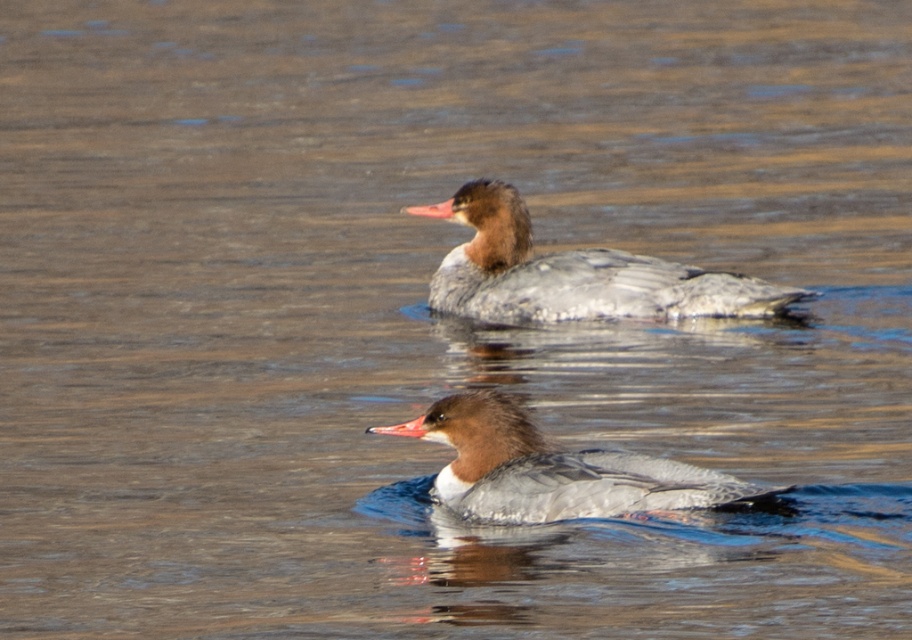
Between brown speckled duck at center and brown-feathered duck at center, which one is positioned higher?

brown speckled duck at center

Which is in front, point (576, 280) or point (606, 492)?

Point (606, 492) is in front.

You are a GUI agent. You are given a task and a screenshot of the screen. Output one action in this format:
    pyautogui.click(x=<x>, y=<y>)
    Task: Click on the brown speckled duck at center
    This screenshot has height=640, width=912.
    Given the screenshot: What is the action you would take?
    pyautogui.click(x=573, y=273)